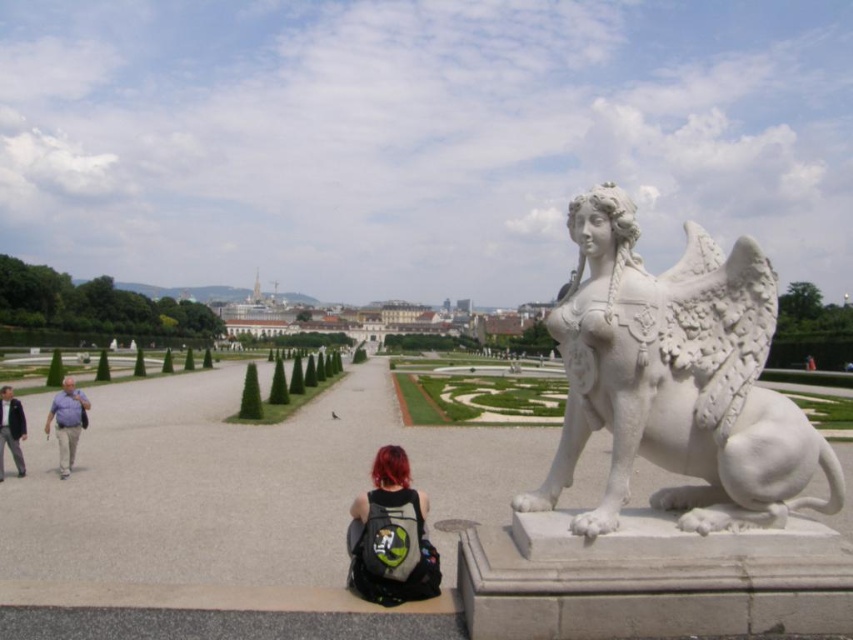
Is shiny black backpack at center further to the viewer compared to light brown leather jacket at lower left?

No, it is not.

Which is below, shiny black backpack at center or light brown leather jacket at lower left?

Positioned lower is shiny black backpack at center.

The image size is (853, 640). What are the coordinates of `shiny black backpack at center` in the screenshot? It's located at (392, 536).

You are a GUI agent. You are given a task and a screenshot of the screen. Output one action in this format:
    pyautogui.click(x=<x>, y=<y>)
    Task: Click on the shiny black backpack at center
    This screenshot has width=853, height=640.
    Given the screenshot: What is the action you would take?
    pos(392,536)

Is white marble sphinx at center positioned before light brown leather jacket at lower left?

Yes, white marble sphinx at center is closer to the viewer.

Looking at this image, how much distance is there between white marble sphinx at center and light brown leather jacket at lower left?

79.69 feet

Between point (630, 442) and point (20, 451), which one is positioned in front?

Point (630, 442) is more forward.

What are the coordinates of `white marble sphinx at center` in the screenshot? It's located at (677, 380).

Is shiny black backpack at center smaller than matte gray shirt at left?

Yes, shiny black backpack at center is smaller than matte gray shirt at left.

Which is below, shiny black backpack at center or matte gray shirt at left?

matte gray shirt at left is below.

Based on the photo, measure the distance between point (422, 592) and camera.

The distance of point (422, 592) from camera is 16.55 meters.

Identify the location of shiny black backpack at center. Image resolution: width=853 pixels, height=640 pixels. (392, 536).